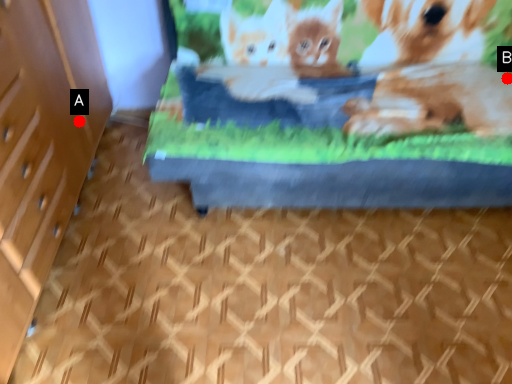
Question: Two points are circled on the image, labeled by A and B beside each circle. Among these points, which one is nearest to the camera?

Choices:
 (A) A is closer
 (B) B is closer

Answer: (A)